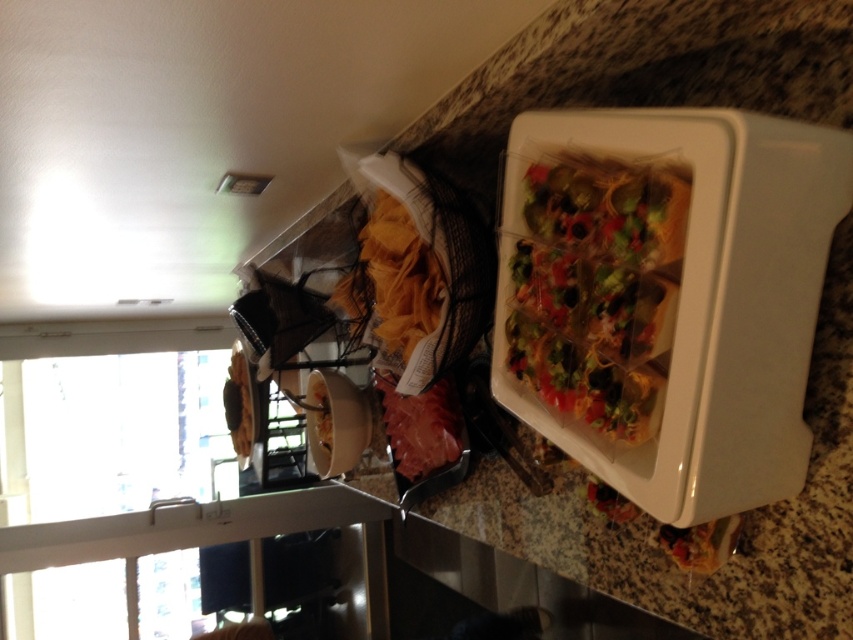
Can you confirm if translucent plastic containers at upper right is positioned to the right of white matte bowl at center?

Yes, translucent plastic containers at upper right is to the right of white matte bowl at center.

Can you confirm if translucent plastic containers at upper right is taller than white matte bowl at center?

No.

Is point (583, 214) more distant than point (242, 417)?

No, (583, 214) is closer to viewer.

Identify the location of translucent plastic containers at upper right. (596, 289).